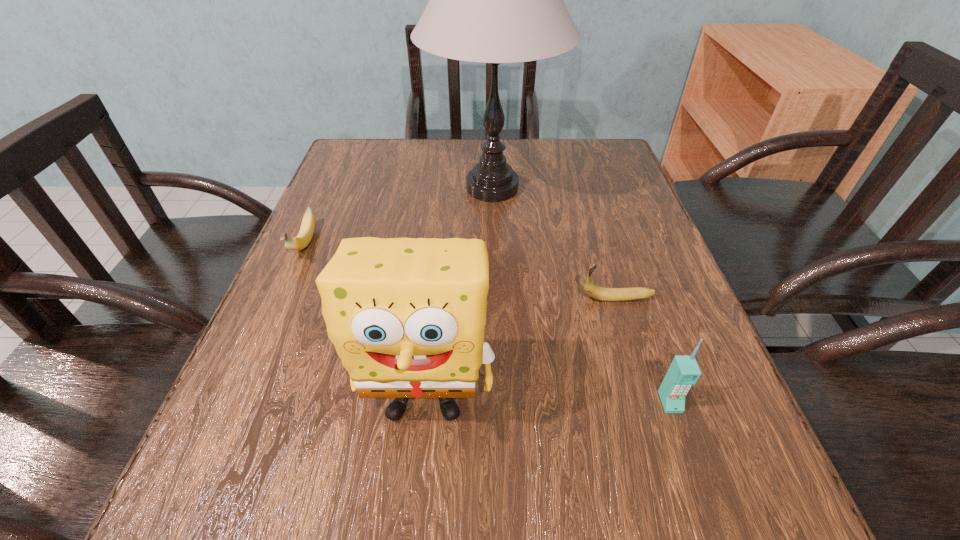
Where is `free space at the left edge`? The width and height of the screenshot is (960, 540). free space at the left edge is located at coordinates (329, 247).

Find the location of `blank space at the right edge of the desktop`. blank space at the right edge of the desktop is located at coordinates (654, 228).

In the image, there is a desktop. Find the location of `vacant space at the far left corner`. vacant space at the far left corner is located at coordinates (384, 174).

Identify the location of free spot at the far right corner of the desktop. This screenshot has width=960, height=540. (563, 142).

I want to click on free space between the cellular telephone and the second tallest object, so click(x=548, y=401).

Identify the location of empty space that is in between the tallest object and the cellular telephone. (581, 295).

Image resolution: width=960 pixels, height=540 pixels. I want to click on free space between the right banana and the cellular telephone, so click(x=643, y=350).

Identify the location of free space that is in between the farther banana and the third tallest object. click(x=488, y=323).

The width and height of the screenshot is (960, 540). Find the location of `empty space between the cellular telephone and the sponge`. empty space between the cellular telephone and the sponge is located at coordinates [x=548, y=401].

The width and height of the screenshot is (960, 540). In order to click on vacant space that is in between the lamp and the farther banana in this screenshot , I will do `click(398, 216)`.